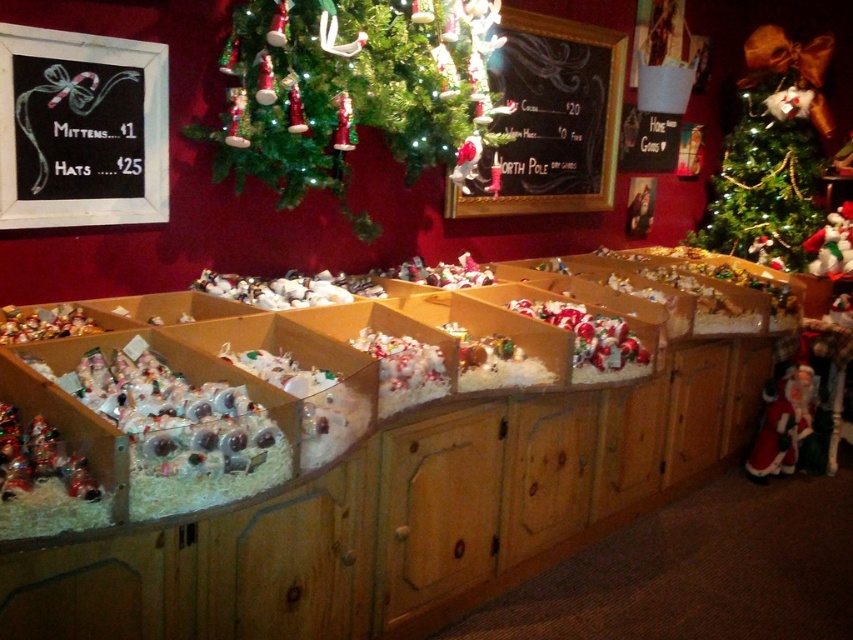
Question: Which point is closer to the camera?

Choices:
 (A) 749,474
 (B) 432,26
 (C) 766,145

Answer: (B)

Question: Is black chalkboard at upper center thinner than green textured christmas tree at upper right?

Choices:
 (A) yes
 (B) no

Answer: (B)

Question: Which point is closer to the camera?

Choices:
 (A) green matte christmas tree at upper center
 (B) velvet santa at right
 (C) white plush santa at right

Answer: (A)

Question: Which point is closer to the camera?

Choices:
 (A) (753, 93)
 (B) (585, 156)
 (C) (758, 454)

Answer: (C)

Question: Where is black chalkboard at upper center located in relation to velvet santa at right in the image?

Choices:
 (A) below
 (B) above

Answer: (B)

Question: Can you confirm if black chalkboard at upper center is wider than green textured christmas tree at upper right?

Choices:
 (A) yes
 (B) no

Answer: (A)